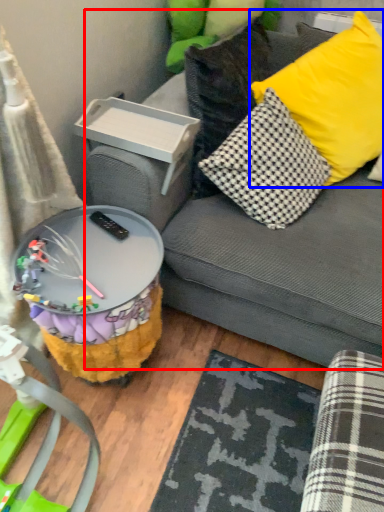
Question: Which point is closer to the camera, studio couch (highlighted by a red box) or pillow (highlighted by a blue box)?

Choices:
 (A) studio couch
 (B) pillow

Answer: (A)